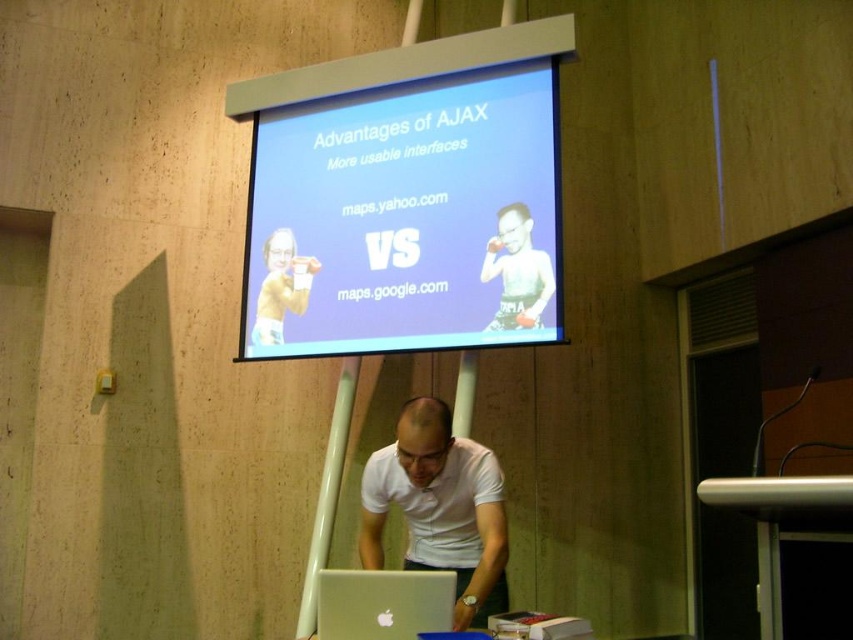
Question: Which object is closer to the camera taking this photo?

Choices:
 (A) white matte shirt at center
 (B) matte white boxer at center
 (C) silver metallic laptop at lower center

Answer: (C)

Question: Can you confirm if blue glossy projector screen at center is positioned to the right of metallic silver table at lower right?

Choices:
 (A) yes
 (B) no

Answer: (B)

Question: Can you confirm if blue glossy projector screen at center is smaller than metallic silver table at lower right?

Choices:
 (A) yes
 (B) no

Answer: (B)

Question: Estimate the real-world distances between objects in this image. Which object is closer to the white matte shirt at center?

Choices:
 (A) blue glossy projector screen at center
 (B) silver metallic laptop at lower center

Answer: (B)

Question: Can you confirm if white matte shirt at center is bigger than matte white boxer at upper center?

Choices:
 (A) no
 (B) yes

Answer: (B)

Question: Which object appears farthest from the camera in this image?

Choices:
 (A) silver metallic laptop at lower center
 (B) matte white boxer at center
 (C) white matte shirt at center
 (D) matte white boxer at upper center

Answer: (B)